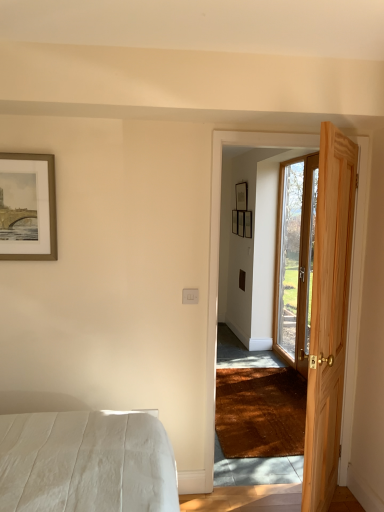
Question: Is clear glass door at right, arranged as the first door when viewed from the back, positioned in front of matte black picture frame at upper center, arranged as the second picture frame when viewed from the right?

Choices:
 (A) no
 (B) yes

Answer: (B)

Question: Is clear glass door at right, acting as the first door starting from the right, at the left side of matte black picture frame at upper center, which appears as the second picture frame when viewed from the left?

Choices:
 (A) yes
 (B) no

Answer: (B)

Question: Is clear glass door at right, acting as the first door starting from the right, bigger than matte black picture frame at upper center, arranged as the second picture frame when viewed from the right?

Choices:
 (A) no
 (B) yes

Answer: (B)

Question: Considering the relative sizes of clear glass door at right, arranged as the first door when viewed from the back, and matte black picture frame at upper center, which appears as the second picture frame when viewed from the left, in the image provided, is clear glass door at right, arranged as the first door when viewed from the back, thinner than matte black picture frame at upper center, which appears as the second picture frame when viewed from the left,?

Choices:
 (A) yes
 (B) no

Answer: (B)

Question: Considering the relative sizes of clear glass door at right, which appears as the second door when viewed from the front, and matte black picture frame at upper center, arranged as the second picture frame when viewed from the right, in the image provided, is clear glass door at right, which appears as the second door when viewed from the front, wider than matte black picture frame at upper center, arranged as the second picture frame when viewed from the right,?

Choices:
 (A) no
 (B) yes

Answer: (B)

Question: In terms of width, does gold-framed artwork at upper left, the 1th picture frame in the front-to-back sequence, look wider or thinner when compared to clear glass door at right, acting as the first door starting from the right?

Choices:
 (A) wide
 (B) thin

Answer: (B)

Question: In terms of height, does gold-framed artwork at upper left, which is the third picture frame from right to left, look taller or shorter compared to clear glass door at right, arranged as the first door when viewed from the back?

Choices:
 (A) short
 (B) tall

Answer: (A)

Question: From a real-world perspective, is gold-framed artwork at upper left, the 1th picture frame in the front-to-back sequence, positioned above or below clear glass door at right, acting as the first door starting from the right?

Choices:
 (A) above
 (B) below

Answer: (A)

Question: Relative to clear glass door at right, arranged as the first door when viewed from the back, is gold-framed artwork at upper left, which is the third picture frame from right to left, in front or behind?

Choices:
 (A) front
 (B) behind

Answer: (A)

Question: In terms of size, does matte black picture frame at upper center, arranged as the second picture frame when viewed from the right, appear bigger or smaller than wooden picture frame at center, arranged as the 2th picture frame when viewed from the back?

Choices:
 (A) big
 (B) small

Answer: (A)

Question: Is point (236, 189) positioned closer to the camera than point (243, 229)?

Choices:
 (A) farther
 (B) closer

Answer: (A)

Question: Is matte black picture frame at upper center, which appears as the second picture frame when viewed from the left, taller or shorter than wooden picture frame at center, which is counted as the third picture frame, starting from the left?

Choices:
 (A) short
 (B) tall

Answer: (A)

Question: In terms of width, does matte black picture frame at upper center, arranged as the second picture frame when viewed from the right, look wider or thinner when compared to wooden picture frame at center, arranged as the 2th picture frame when viewed from the back?

Choices:
 (A) thin
 (B) wide

Answer: (B)

Question: Is clear glass door at right, arranged as the first door when viewed from the back, inside or outside of wooden picture frame at center, which is counted as the 2th picture frame, starting from the front?

Choices:
 (A) outside
 (B) inside

Answer: (A)

Question: Considering the positions of clear glass door at right, arranged as the first door when viewed from the back, and wooden picture frame at center, which is counted as the third picture frame, starting from the left, in the image, is clear glass door at right, arranged as the first door when viewed from the back, taller or shorter than wooden picture frame at center, which is counted as the third picture frame, starting from the left,?

Choices:
 (A) tall
 (B) short

Answer: (A)